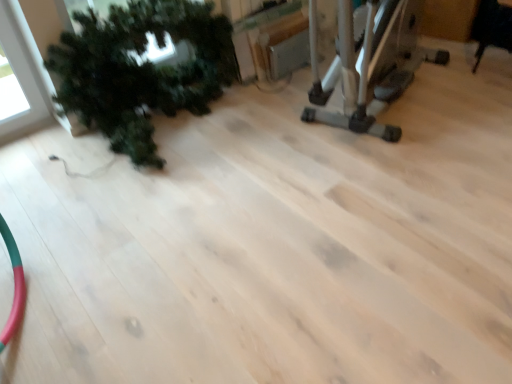
At what (x,y) coordinates should I click in order to perform the action: click on green matte plant at left. Please return your answer as a coordinate pair (x, y). The height and width of the screenshot is (384, 512). Looking at the image, I should click on (141, 70).

Where is `black leather chair at upper right`? black leather chair at upper right is located at coordinates (494, 27).

What do you see at coordinates (370, 65) in the screenshot? This screenshot has width=512, height=384. I see `silver metallic elliptical trainer at upper right` at bounding box center [370, 65].

Locate an element on the screen. The height and width of the screenshot is (384, 512). green matte plant at left is located at coordinates point(141,70).

In the scene shown: Is green matte plant at left in contact with silver metallic elliptical trainer at upper right?

No, green matte plant at left is not beside silver metallic elliptical trainer at upper right.

Considering the sizes of objects green matte plant at left and silver metallic elliptical trainer at upper right in the image provided, who is bigger, green matte plant at left or silver metallic elliptical trainer at upper right?

With larger size is silver metallic elliptical trainer at upper right.

Is green matte plant at left thinner than silver metallic elliptical trainer at upper right?

Yes.

Is silver metallic elliptical trainer at upper right completely or partially inside green matte plant at left?

That's incorrect, silver metallic elliptical trainer at upper right is not inside green matte plant at left.

Does green matte plant at left appear on the left side of black leather chair at upper right?

Yes, green matte plant at left is to the left of black leather chair at upper right.

Who is smaller, green matte plant at left or black leather chair at upper right?

black leather chair at upper right is smaller.

Is green matte plant at left facing towards black leather chair at upper right?

No, green matte plant at left is not aimed at black leather chair at upper right.

Locate an element on the screen. chair beneath the green matte plant at left (from a real-world perspective) is located at coordinates (494, 27).

Does black leather chair at upper right have a greater height compared to green matte plant at left?

No.

Is point (507, 43) closer or farther from the camera than point (196, 114)?

Point (507, 43) is farther from the camera than point (196, 114).

Based on their sizes in the image, would you say black leather chair at upper right is bigger or smaller than green matte plant at left?

Clearly, black leather chair at upper right is smaller in size than green matte plant at left.

Can you tell me how much silver metallic elliptical trainer at upper right and green matte plant at left differ in facing direction?

There is a 71.9-degree angle between the facing directions of silver metallic elliptical trainer at upper right and green matte plant at left.

Which is in front, point (409, 43) or point (100, 90)?

The point (100, 90) is more forward.

From the image's perspective, is silver metallic elliptical trainer at upper right located above green matte plant at left?

Yes, from the image's perspective, silver metallic elliptical trainer at upper right is over green matte plant at left.

Who is taller, black leather chair at upper right or silver metallic elliptical trainer at upper right?

silver metallic elliptical trainer at upper right.

What's the angular difference between black leather chair at upper right and silver metallic elliptical trainer at upper right's facing directions?

The angular difference between black leather chair at upper right and silver metallic elliptical trainer at upper right is 24.1 degrees.

From a real-world perspective, who is located higher, black leather chair at upper right or silver metallic elliptical trainer at upper right?

From a 3D spatial view, silver metallic elliptical trainer at upper right is above.

Is black leather chair at upper right not inside silver metallic elliptical trainer at upper right?

Yes.

In the scene shown: Is the depth of silver metallic elliptical trainer at upper right less than that of black leather chair at upper right?

Yes.

Is black leather chair at upper right at the back of silver metallic elliptical trainer at upper right?

silver metallic elliptical trainer at upper right does not have its back to black leather chair at upper right.

Measure the distance between silver metallic elliptical trainer at upper right and black leather chair at upper right.

silver metallic elliptical trainer at upper right is 31.49 inches from black leather chair at upper right.

Between silver metallic elliptical trainer at upper right and black leather chair at upper right, which one has smaller size?

With smaller size is black leather chair at upper right.

Find the location of a particular element. The image size is (512, 384). equipment located above the green matte plant at left (from a real-world perspective) is located at coordinates (370, 65).

This screenshot has height=384, width=512. I want to click on houseplant below the black leather chair at upper right (from the image's perspective), so [141, 70].

From the image, which object appears to be nearer to green matte plant at left, black leather chair at upper right or silver metallic elliptical trainer at upper right?

silver metallic elliptical trainer at upper right.

Which object lies nearer to the anchor point black leather chair at upper right, silver metallic elliptical trainer at upper right or green matte plant at left?

silver metallic elliptical trainer at upper right lies closer to black leather chair at upper right than the other object.

Estimate the real-world distances between objects in this image. Which object is closer to black leather chair at upper right, green matte plant at left or silver metallic elliptical trainer at upper right?

silver metallic elliptical trainer at upper right.

From the image, which object appears to be farther from green matte plant at left, silver metallic elliptical trainer at upper right or black leather chair at upper right?

black leather chair at upper right lies further to green matte plant at left than the other object.

When comparing their distances from silver metallic elliptical trainer at upper right, does black leather chair at upper right or green matte plant at left seem further?

green matte plant at left is positioned further to the anchor silver metallic elliptical trainer at upper right.

Estimate the real-world distances between objects in this image. Which object is further from silver metallic elliptical trainer at upper right, green matte plant at left or black leather chair at upper right?

The object further to silver metallic elliptical trainer at upper right is green matte plant at left.

At what (x,y) coordinates should I click in order to perform the action: click on equipment located between green matte plant at left and black leather chair at upper right in the left-right direction. Please return your answer as a coordinate pair (x, y). Looking at the image, I should click on (370, 65).